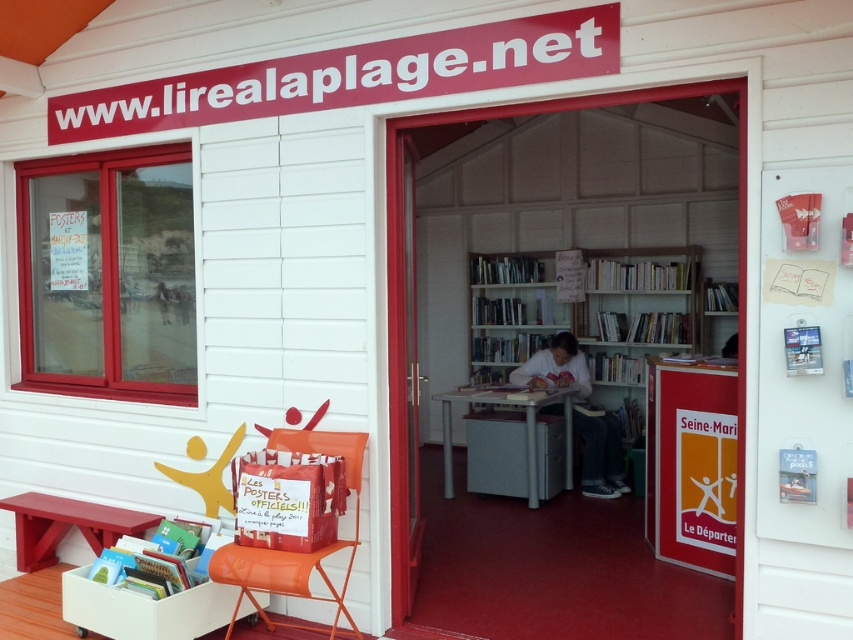
Is white wooden bookshelf at center positioned before wooden door at center?

No, white wooden bookshelf at center is behind wooden door at center.

Can you confirm if white wooden bookshelf at center is shorter than wooden door at center?

Yes.

Image resolution: width=853 pixels, height=640 pixels. In order to click on white wooden bookshelf at center in this screenshot , I will do `click(587, 316)`.

Is white wooden bookshelf at center thinner than matte red bench at lower left?

In fact, white wooden bookshelf at center might be wider than matte red bench at lower left.

Who is taller, white wooden bookshelf at center or matte red bench at lower left?

With more height is white wooden bookshelf at center.

The height and width of the screenshot is (640, 853). I want to click on white wooden bookshelf at center, so click(x=587, y=316).

Is wooden door at center positioned behind matte red bench at lower left?

No, wooden door at center is in front of matte red bench at lower left.

Is point (646, 93) closer to camera compared to point (3, 506)?

Yes, it is in front of point (3, 506).

You are a GUI agent. You are given a task and a screenshot of the screen. Output one action in this format:
    pyautogui.click(x=<x>, y=<y>)
    Task: Click on the wooden door at center
    
    Given the screenshot: What is the action you would take?
    pyautogui.click(x=404, y=276)